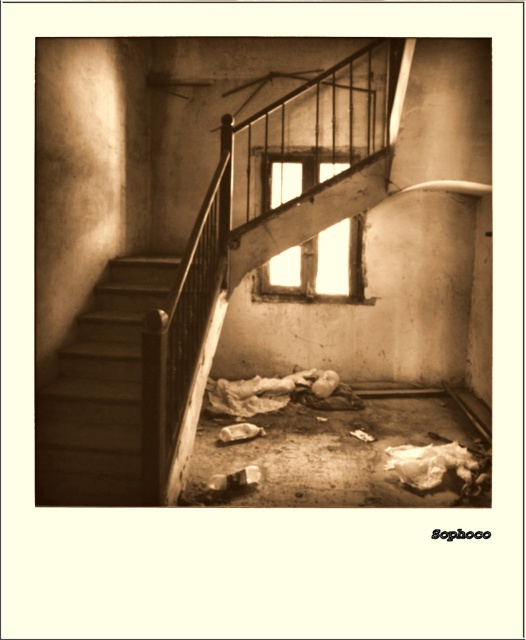
Question: Is smooth wooden stairs at left above translucent glass window at center?

Choices:
 (A) no
 (B) yes

Answer: (A)

Question: Among these objects, which one is nearest to the camera?

Choices:
 (A) translucent glass window at center
 (B) smooth wooden stairs at left

Answer: (B)

Question: Can you confirm if smooth wooden stairs at left is smaller than translucent glass window at center?

Choices:
 (A) no
 (B) yes

Answer: (A)

Question: Is smooth wooden stairs at left to the right of translucent glass window at center from the viewer's perspective?

Choices:
 (A) yes
 (B) no

Answer: (B)